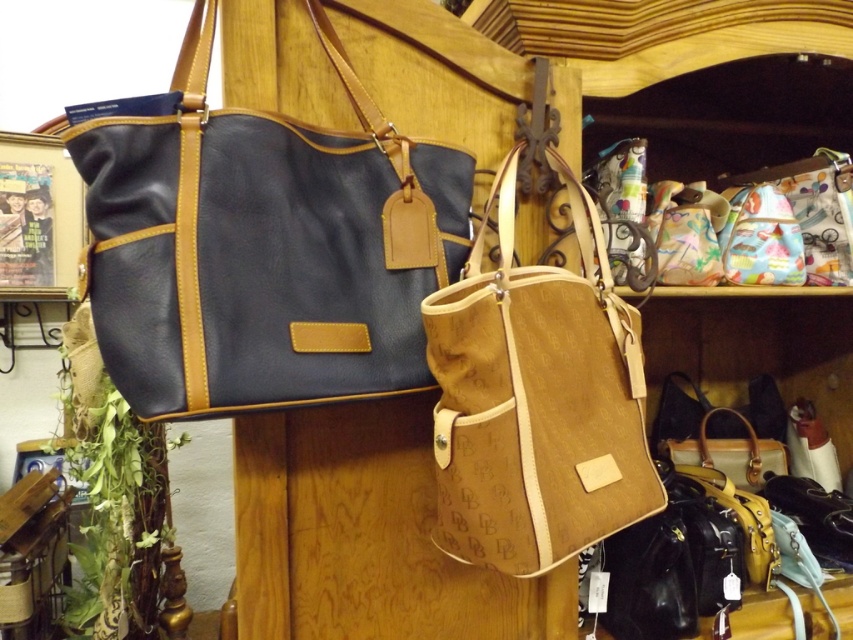
You are a customer looking to purchase a handbag. You see the matte black leather shoulder bag at left and the brown canvas tote at center. Which handbag is positioned higher in the display?

The matte black leather shoulder bag at left is positioned higher than the brown canvas tote at center in the display.

You are a customer in a store and see the matte black leather shoulder bag at left and the brown canvas tote at center. Which one is located to the left of the other?

The matte black leather shoulder bag at left is positioned on the left side of brown canvas tote at center.

You are a customer in a store holding a camera. You want to place the camera on the matte black leather shoulder bag at left. Is the distance between the camera and the bag sufficient to allow you to do this without moving either item?

The matte black leather shoulder bag at left and camera are 70.56 centimeters apart. Since the distance is more than the required space needed to place the camera on the bag, you can do so without moving either item.